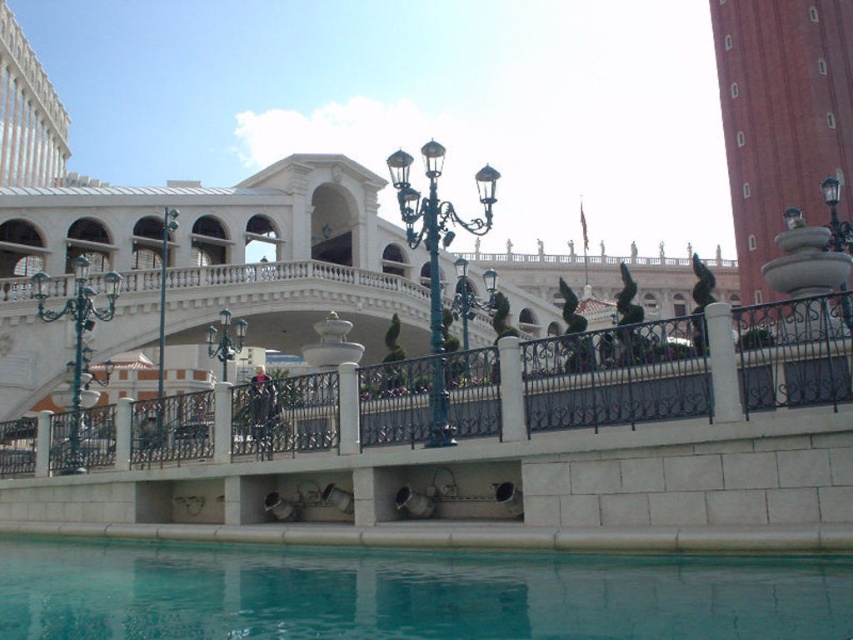
Question: Can you confirm if black wrought iron railing at center is smaller than white stone pillar at center?

Choices:
 (A) no
 (B) yes

Answer: (A)

Question: Does clear glass pool at lower center appear on the left side of white stone pillar at center?

Choices:
 (A) no
 (B) yes

Answer: (B)

Question: Which of these objects is positioned farthest from the clear glass pool at lower center?

Choices:
 (A) white stone pillar at center
 (B) black wrought iron railing at center

Answer: (A)

Question: Which point appears farthest from the camera in this image?

Choices:
 (A) (195, 611)
 (B) (523, 420)

Answer: (B)

Question: Does clear glass pool at lower center lie behind white stone pillar at center?

Choices:
 (A) yes
 (B) no

Answer: (B)

Question: Estimate the real-world distances between objects in this image. Which object is closer to the clear glass pool at lower center?

Choices:
 (A) white stone pillar at center
 (B) black wrought iron railing at center

Answer: (B)